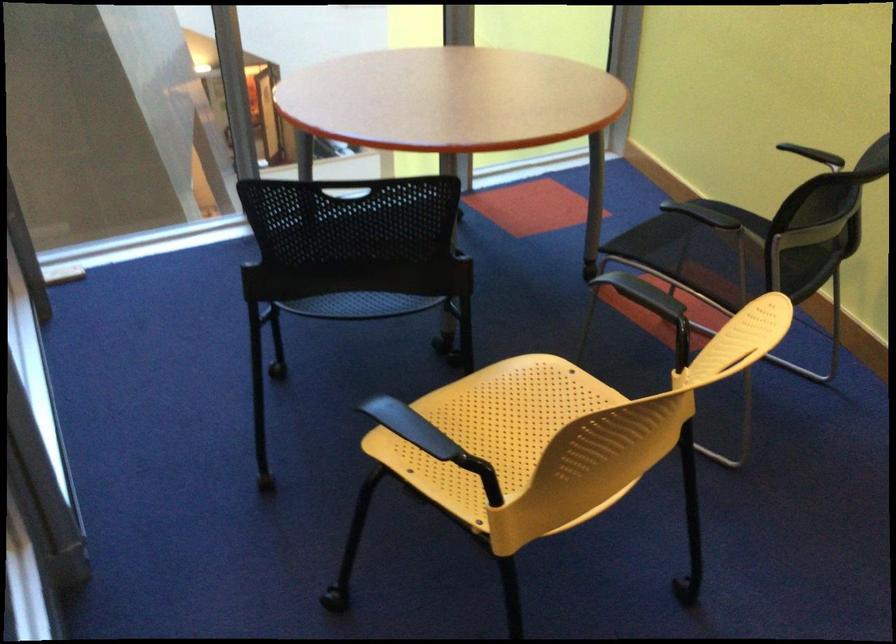
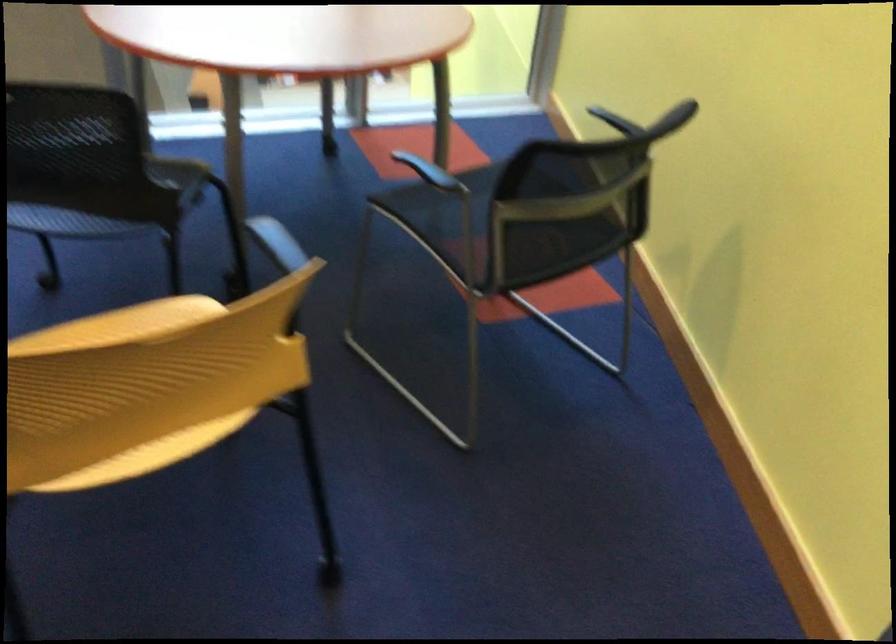
Question: Which direction would the cameraman need to move to produce the second image? Reply with the corresponding letter.

Choices:
 (A) Left
 (B) Right
 (C) Forward
 (D) Backward

Answer: (B)